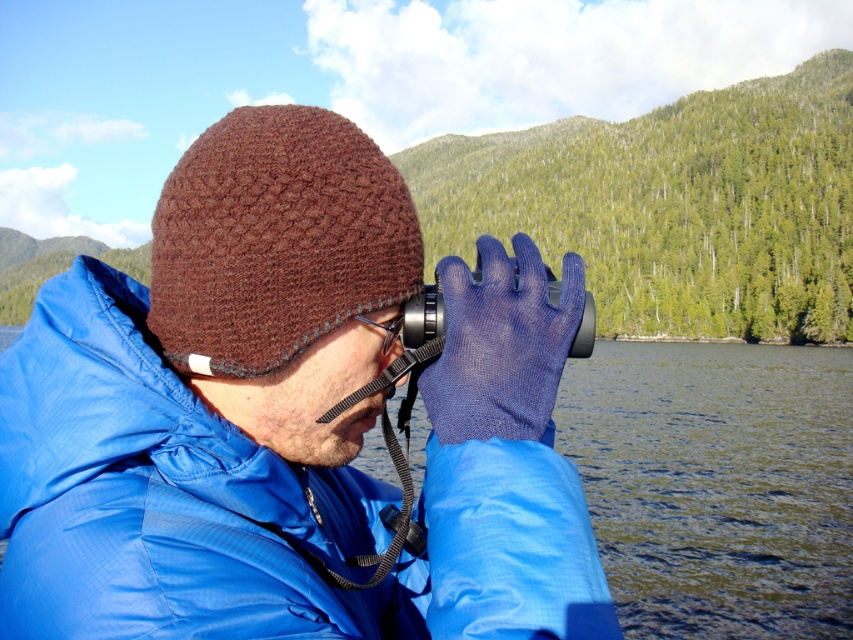
Question: Estimate the real-world distances between objects in this image. Which object is farther from the black rubber goggles at center?

Choices:
 (A) brown knitted hat at upper left
 (B) brown knitted hat at upper center

Answer: (B)

Question: Is brown knitted hat at upper left thinner than black rubber goggles at center?

Choices:
 (A) no
 (B) yes

Answer: (B)

Question: Does brown knitted hat at upper left appear over black rubber goggles at center?

Choices:
 (A) no
 (B) yes

Answer: (B)

Question: Where is brown knitted hat at upper center located in relation to black rubber goggles at center in the image?

Choices:
 (A) above
 (B) below

Answer: (B)

Question: Among these points, which one is nearest to the camera?

Choices:
 (A) (469, 545)
 (B) (287, 266)
 (C) (373, 323)

Answer: (A)

Question: Which object appears farthest from the camera in this image?

Choices:
 (A) black rubber goggles at center
 (B) brown knitted hat at upper left

Answer: (B)